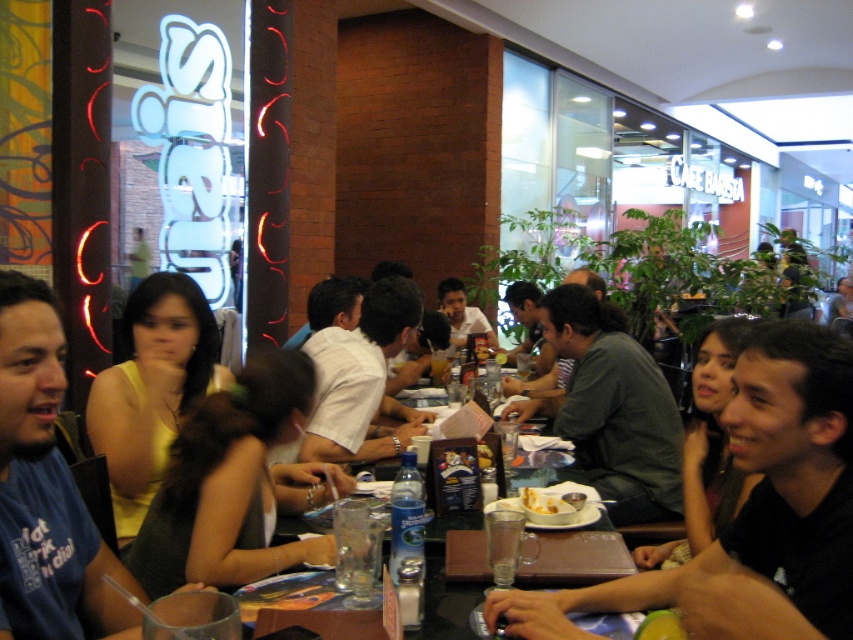
Question: Does yellow fabric shirt at center appear on the left side of clear glass table at center?

Choices:
 (A) no
 (B) yes

Answer: (B)

Question: Does dark green shirt at center appear over clear glass table at center?

Choices:
 (A) yes
 (B) no

Answer: (A)

Question: Is black matte shirt at center further to camera compared to dark green fabric dress at center?

Choices:
 (A) yes
 (B) no

Answer: (B)

Question: Which object appears farthest from the camera in this image?

Choices:
 (A) white shirt at center
 (B) dark green shirt at center

Answer: (B)

Question: Which object is closer to the camera taking this photo?

Choices:
 (A) yellow fabric shirt at center
 (B) dark green shirt at center

Answer: (A)

Question: Which of the following is the farthest from the observer?

Choices:
 (A) [318, 408]
 (B) [276, 444]

Answer: (A)